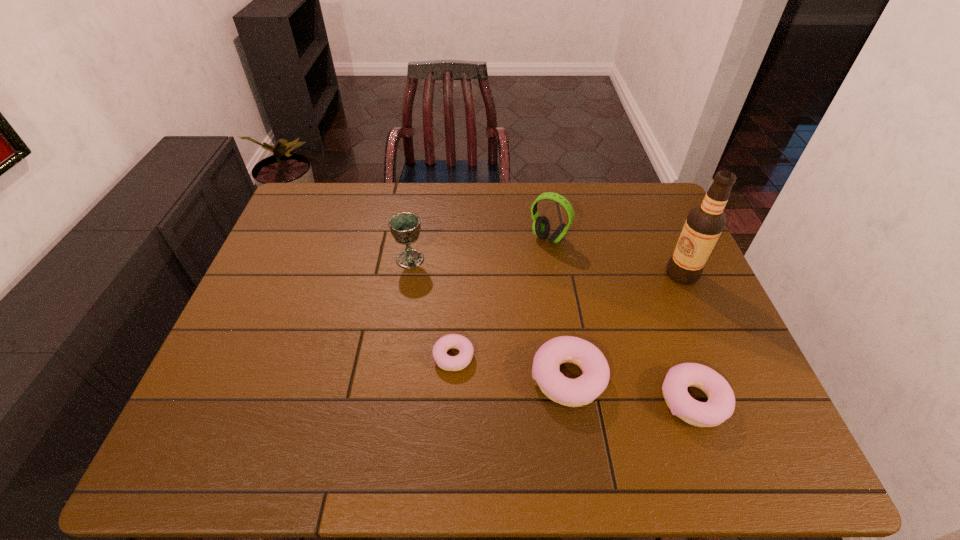
The doughnuts are evenly distributed in the image. To maintain this, where would you place another doughnut on the left? Please point to a free space. Please provide its 2D coordinates. Your answer should be formatted as a tuple, i.e. [(x, y)], where the tuple contains the x and y coordinates of a point satisfying the conditions above.

[(348, 338)]